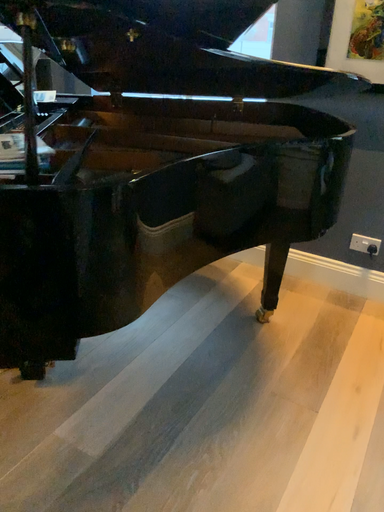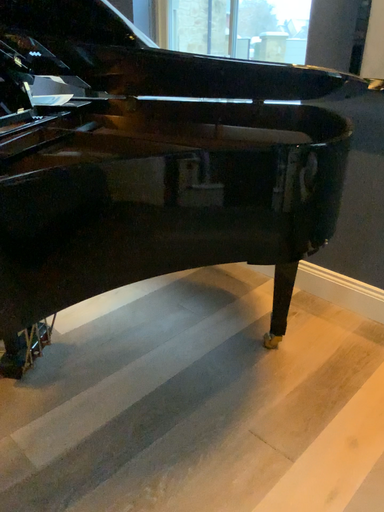
Question: How did the camera likely rotate when shooting the video?

Choices:
 (A) rotated right
 (B) rotated left

Answer: (B)